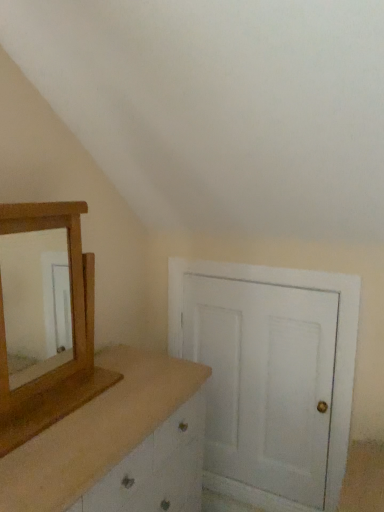
The image size is (384, 512). Find the location of `empty space that is ontop of white matte door at center`. empty space that is ontop of white matte door at center is located at coordinates [x=261, y=283].